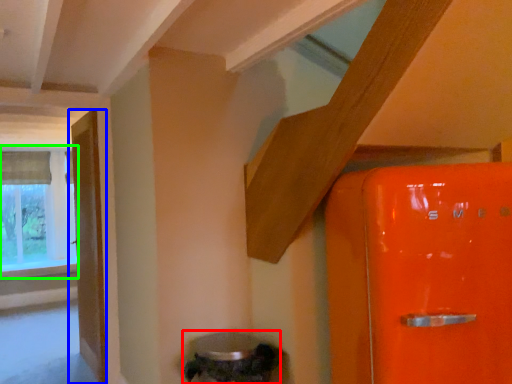
Question: Considering the real-world distances, which object is closest to water heater (highlighted by a red box)? door (highlighted by a blue box) or window (highlighted by a green box).

Choices:
 (A) door
 (B) window

Answer: (A)